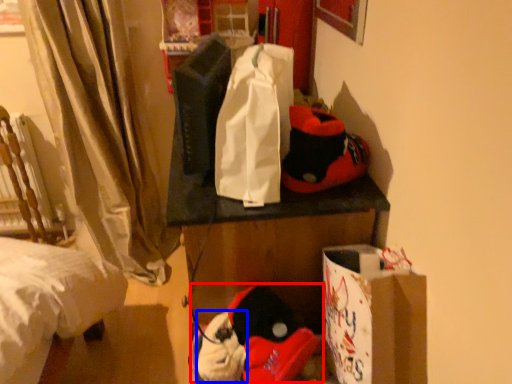
Question: Which of the following is the closest to the observer, toy (highlighted by a red box) or toy (highlighted by a blue box)?

Choices:
 (A) toy
 (B) toy

Answer: (A)